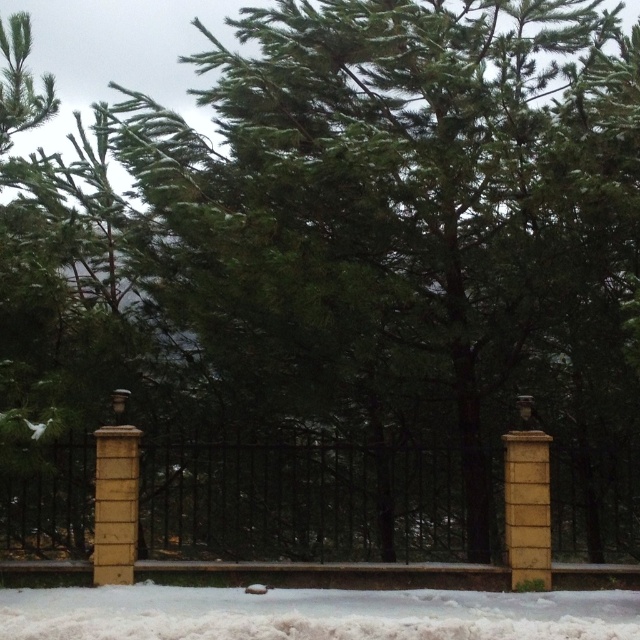
Between point (147, 464) and point (548, 627), which one is positioned in front?

Point (548, 627) is in front.

Is brown stone fence at center below white fluffy snow at lower center?

Actually, brown stone fence at center is above white fluffy snow at lower center.

Find the location of `brown stone fence at center`. brown stone fence at center is located at coordinates (300, 500).

Where is `brown stone fence at center`? brown stone fence at center is located at coordinates (300, 500).